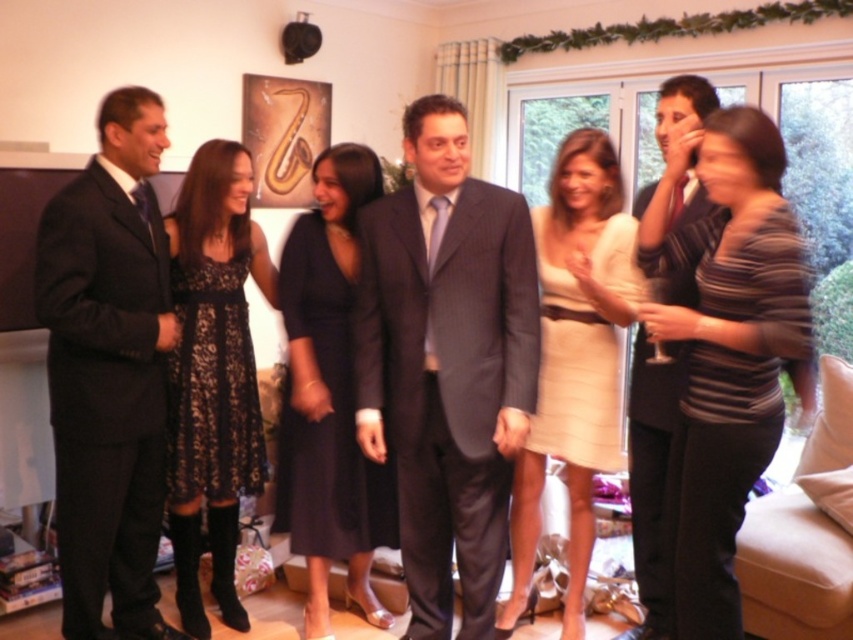
Question: Does matte cream dress at center appear under matte black suit at right?

Choices:
 (A) no
 (B) yes

Answer: (B)

Question: Among these points, which one is nearest to the camera?

Choices:
 (A) (538, 513)
 (B) (202, 371)

Answer: (B)

Question: Based on their relative distances, which object is nearer to the dark gray suit at center?

Choices:
 (A) matte cream dress at center
 (B) black lace dress at left

Answer: (A)

Question: Is striped fabric dress at right bigger than black lace dress at center?

Choices:
 (A) yes
 (B) no

Answer: (A)

Question: Does black satin dress at center appear on the right side of matte black suit at right?

Choices:
 (A) yes
 (B) no

Answer: (B)

Question: Which point is farther from the camera taking this photo?

Choices:
 (A) (720, 445)
 (B) (141, 145)

Answer: (B)